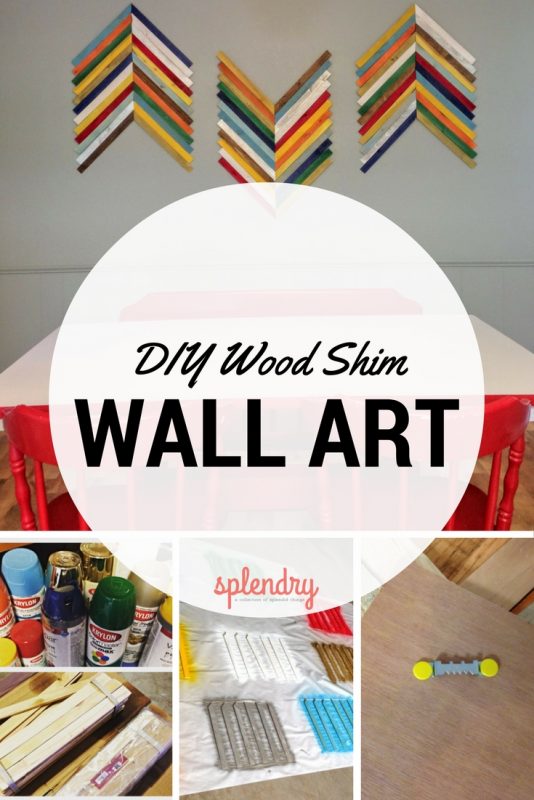
This screenshot has width=534, height=800. I want to click on box, so click(104, 734).